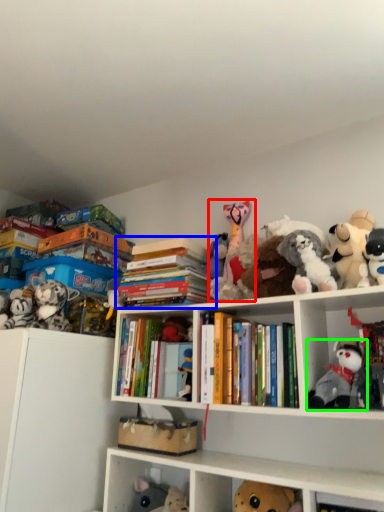
Question: Which object is positioned farthest from toy (highlighted by a red box)? Select from book (highlighted by a blue box) and toy (highlighted by a green box).

Choices:
 (A) book
 (B) toy

Answer: (B)